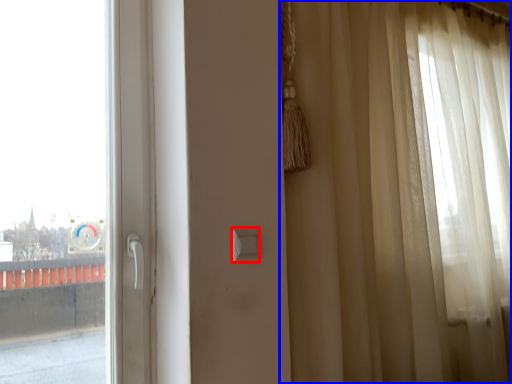
Question: Among these objects, which one is nearest to the camera, light switch (highlighted by a red box) or curtain (highlighted by a blue box)?

Choices:
 (A) light switch
 (B) curtain

Answer: (B)